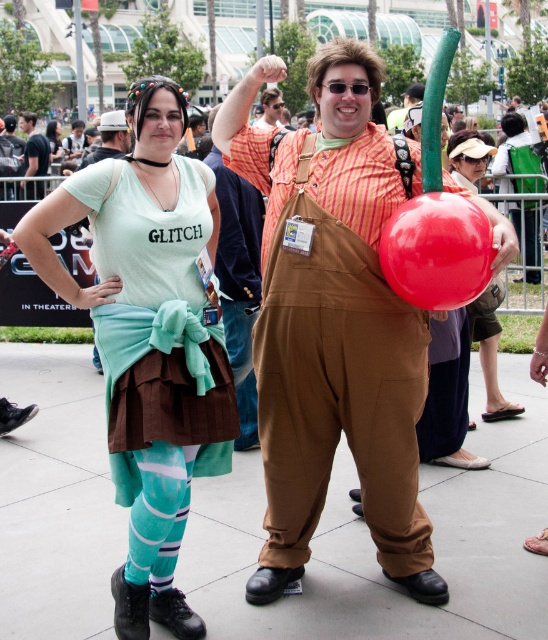
You are at the event and want to take a photo of the red rubber balloon at center. Where should you position yourself to capture it in the frame?

The red rubber balloon at center is located at point (436, 250), so position yourself facing the center area where the balloon is placed to include it in your photo.

You are taking a photo of two points in the scene. The first point is labeled as point (475, 220) and the second is point (53, 134). Which point will appear larger in your photo?

Point (475, 220) is closer to the camera than point (53, 134), so it will appear larger in the photo.